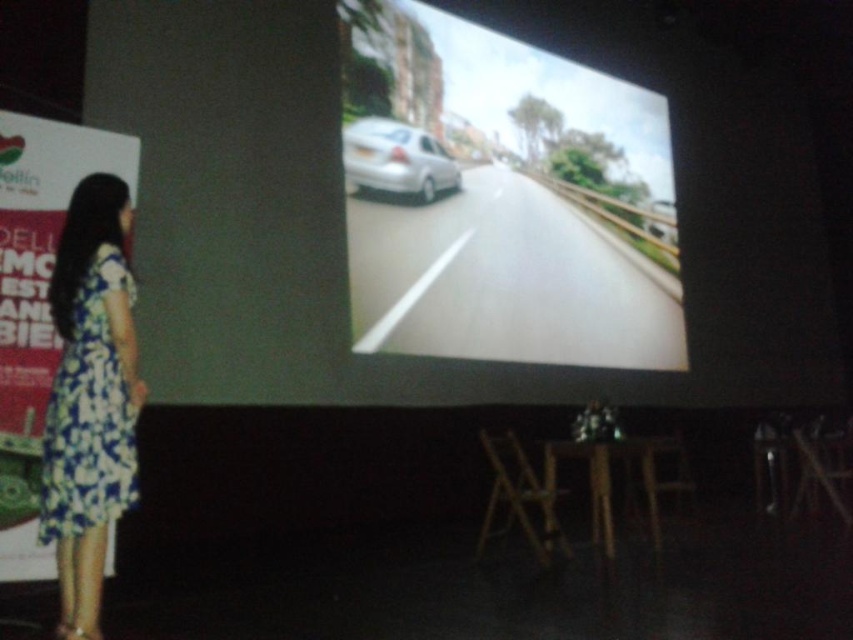
Question: Which object is farther from the camera taking this photo?

Choices:
 (A) metallic silver car at right
 (B) satin silver sedan at center
 (C) metallic silver car at center
 (D) floral fabric dress at left

Answer: (A)

Question: Is floral fabric dress at left behind satin silver sedan at center?

Choices:
 (A) no
 (B) yes

Answer: (A)

Question: Which of the following is the farthest from the observer?

Choices:
 (A) floral fabric dress at left
 (B) wooden stool at lower center
 (C) satin silver sedan at center

Answer: (C)

Question: Is floral fabric dress at left smaller than metallic silver car at right?

Choices:
 (A) no
 (B) yes

Answer: (A)

Question: Does metallic silver car at center appear under satin silver sedan at center?

Choices:
 (A) yes
 (B) no

Answer: (A)

Question: Which object is the farthest from the satin silver sedan at center?

Choices:
 (A) floral fabric dress at left
 (B) metallic silver car at right
 (C) wooden stool at lower center

Answer: (A)